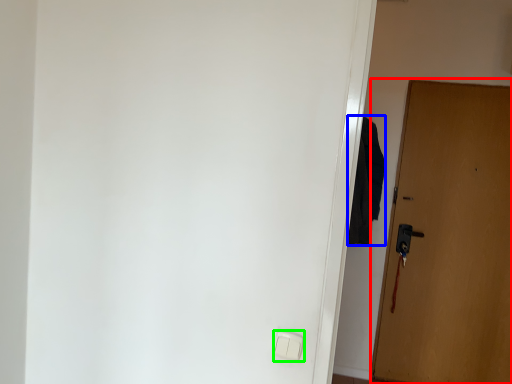
Question: Estimate the real-world distances between objects in this image. Which object is farther from door (highlighted by a red box), robe (highlighted by a blue box) or light switch (highlighted by a green box)?

Choices:
 (A) robe
 (B) light switch

Answer: (B)